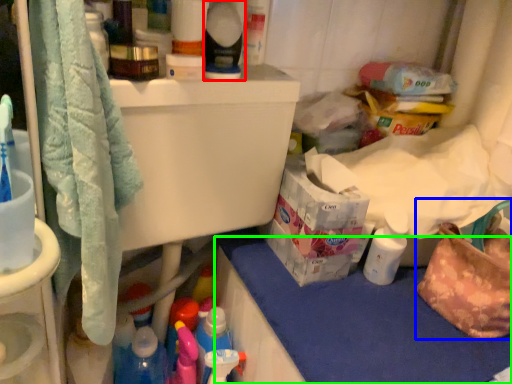
Question: Which is farther away from cleaning product (highlighted by a red box)? handbag (highlighted by a blue box) or counter top (highlighted by a green box)?

Choices:
 (A) handbag
 (B) counter top

Answer: (A)